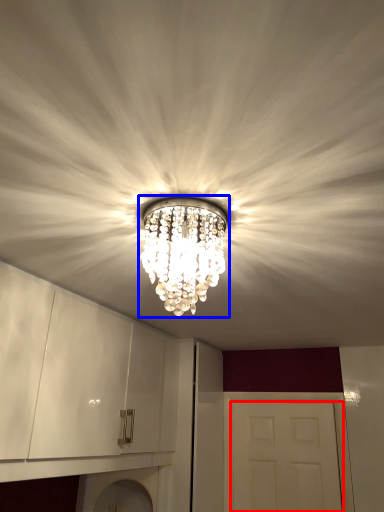
Question: Which of the following is the closest to the observer, door (highlighted by a red box) or lamp (highlighted by a blue box)?

Choices:
 (A) door
 (B) lamp

Answer: (B)